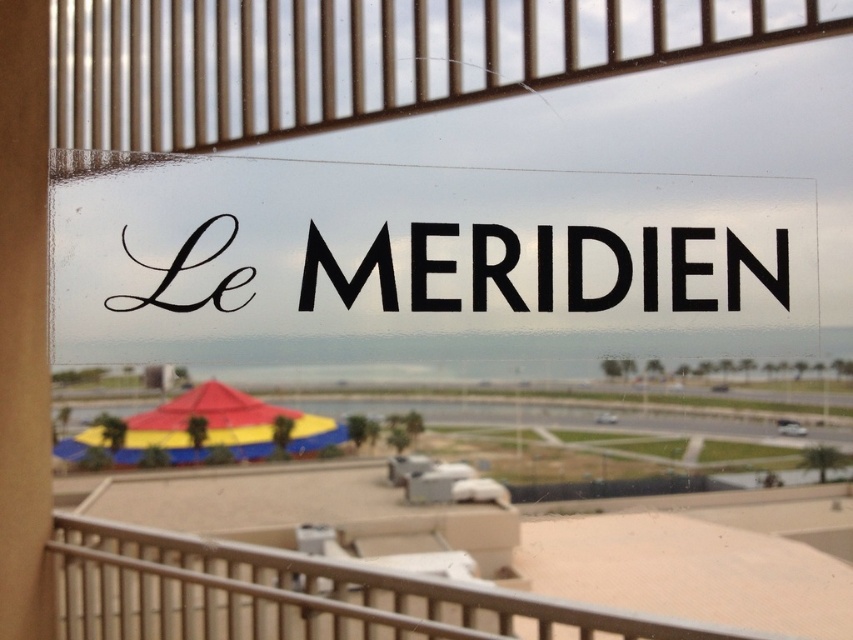
Question: Is the position of black glossy sign at center less distant than that of metallic brown balustrade at upper center?

Choices:
 (A) yes
 (B) no

Answer: (A)

Question: Which point is closer to the camera taking this photo?

Choices:
 (A) (352, 602)
 (B) (215, 442)

Answer: (A)

Question: Is the position of black glossy sign at center more distant than that of metallic silver balustrade at center?

Choices:
 (A) yes
 (B) no

Answer: (A)

Question: Among these points, which one is farthest from the camera?

Choices:
 (A) (730, 180)
 (B) (364, 593)

Answer: (A)

Question: Can you confirm if black glossy sign at center is positioned below multicolored fabric umbrella at lower left?

Choices:
 (A) no
 (B) yes

Answer: (A)

Question: Which of the following is the closest to the observer?

Choices:
 (A) metallic silver balustrade at center
 (B) multicolored fabric umbrella at lower left
 (C) metallic brown balustrade at upper center
 (D) black glossy sign at center

Answer: (A)